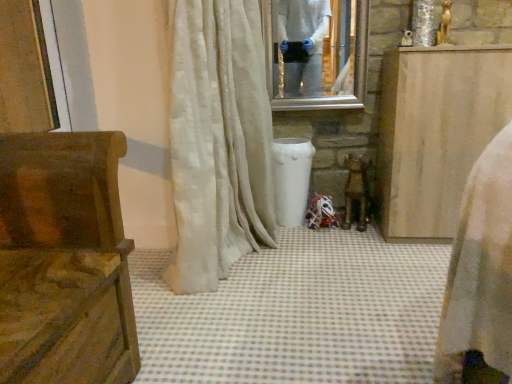
You are a GUI agent. You are given a task and a screenshot of the screen. Output one action in this format:
    pyautogui.click(x=<x>, y=<y>)
    Task: Click on the wooden at center
    
    Given the screenshot: What is the action you would take?
    pyautogui.click(x=356, y=192)

Describe the element at coordinates (218, 140) in the screenshot. The height and width of the screenshot is (384, 512). I see `white silky curtain at center` at that location.

Measure the distance between point [300,83] and camera.

Point [300,83] and camera are 2.16 meters apart from each other.

Where is `clear glass mirror at upper center`? The image size is (512, 384). clear glass mirror at upper center is located at coordinates click(x=313, y=47).

At what (x,y) coordinates should I click in order to perform the action: click on wooden carved bench at left, arranged as the 1th furniture when viewed from the left. Please return your answer as a coordinate pair (x, y). The width and height of the screenshot is (512, 384). Looking at the image, I should click on (67, 229).

Measure the distance from light brown wood cabinet at right, which is counted as the second furniture, starting from the front, to wooden carved bench at left, positioned as the second furniture in right-to-left order.

light brown wood cabinet at right, which is counted as the second furniture, starting from the front, and wooden carved bench at left, positioned as the second furniture in right-to-left order, are 4.47 feet apart from each other.

Considering the positions of objects light brown wood cabinet at right, the first furniture viewed from the back, and wooden carved bench at left, positioned as the second furniture in right-to-left order, in the image provided, who is in front, light brown wood cabinet at right, the first furniture viewed from the back, or wooden carved bench at left, positioned as the second furniture in right-to-left order,?

wooden carved bench at left, positioned as the second furniture in right-to-left order, is in front.

Is light brown wood cabinet at right, arranged as the first furniture when viewed from the right, placed right next to wooden carved bench at left, which ranks as the second furniture in back-to-front order?

They are not placed beside each other.

Consider the image. Is light brown wood cabinet at right, the first furniture viewed from the back, shorter than wooden carved bench at left, positioned as the second furniture in right-to-left order?

In fact, light brown wood cabinet at right, the first furniture viewed from the back, may be taller than wooden carved bench at left, positioned as the second furniture in right-to-left order.

Can you confirm if clear glass mirror at upper center is wider than wooden at center?

No.

From the image's perspective, between clear glass mirror at upper center and wooden at center, who is located below?

wooden at center appears lower in the image.

Could you tell me if clear glass mirror at upper center is turned towards wooden at center?

No.

Can you tell me how much clear glass mirror at upper center and wooden at center differ in facing direction?

10.9 degrees separate the facing orientations of clear glass mirror at upper center and wooden at center.

Does point (410, 61) come farther from viewer compared to point (325, 58)?

No, (410, 61) is in front of (325, 58).

Which object is further away from the camera, light brown wood cabinet at right, arranged as the first furniture when viewed from the right, or clear glass mirror at upper center?

clear glass mirror at upper center is further away from the camera.

From the image's perspective, between light brown wood cabinet at right, which is counted as the second furniture, starting from the front, and clear glass mirror at upper center, which one is located above?

clear glass mirror at upper center is shown above in the image.

Visually, is light brown wood cabinet at right, the first furniture viewed from the back, positioned to the left or to the right of clear glass mirror at upper center?

Clearly, light brown wood cabinet at right, the first furniture viewed from the back, is on the right of clear glass mirror at upper center in the image.

From a real-world perspective, which is physically above, white silky curtain at center or wooden at center?

From a 3D spatial view, white silky curtain at center is above.

Is white silky curtain at center touching wooden at center?

No, white silky curtain at center is not beside wooden at center.

Which is further, (199, 248) or (368, 211)?

The point (368, 211) is more distant.

Considering the relative sizes of wooden at center and light brown wood cabinet at right, the first furniture viewed from the back, in the image provided, is wooden at center wider than light brown wood cabinet at right, the first furniture viewed from the back,?

Incorrect, the width of wooden at center does not surpass that of light brown wood cabinet at right, the first furniture viewed from the back.

Is wooden at center to the right of light brown wood cabinet at right, arranged as the first furniture when viewed from the right, from the viewer's perspective?

In fact, wooden at center is to the left of light brown wood cabinet at right, arranged as the first furniture when viewed from the right.

Can you see wooden at center touching light brown wood cabinet at right, which is counted as the second furniture, starting from the front?

No, wooden at center is not touching light brown wood cabinet at right, which is counted as the second furniture, starting from the front.

Find the location of a particular element. Image resolution: width=512 pixels, height=384 pixels. curtain that is above the wooden carved bench at left, positioned as the second furniture in right-to-left order (from the image's perspective) is located at coordinates (218, 140).

Is wooden carved bench at left, arranged as the 1th furniture when viewed from the left, further to camera compared to white silky curtain at center?

No.

Is white silky curtain at center inside wooden carved bench at left, arranged as the 1th furniture when viewed from the left?

No, white silky curtain at center is not surrounded by wooden carved bench at left, arranged as the 1th furniture when viewed from the left.

From a real-world perspective, which is physically above, wooden carved bench at left, the first furniture when ordered from front to back, or white silky curtain at center?

white silky curtain at center.

From a real-world perspective, does white silky curtain at center sit lower than light brown wood cabinet at right, the first furniture viewed from the back?

No, from a real-world perspective, white silky curtain at center is not beneath light brown wood cabinet at right, the first furniture viewed from the back.

Which object is closer to the camera taking this photo, white silky curtain at center or light brown wood cabinet at right, which is counted as the second furniture, starting from the front?

white silky curtain at center is in front.

Looking at the image, does white silky curtain at center seem bigger or smaller compared to light brown wood cabinet at right, arranged as the first furniture when viewed from the right?

Clearly, white silky curtain at center is larger in size than light brown wood cabinet at right, arranged as the first furniture when viewed from the right.

Is point (203, 149) closer to camera compared to point (503, 102)?

That is True.

In order to click on furniture that appears behind the wooden carved bench at left, arranged as the 1th furniture when viewed from the left in this screenshot , I will do `click(436, 131)`.

You are a GUI agent. You are given a task and a screenshot of the screen. Output one action in this format:
    pyautogui.click(x=<x>, y=<y>)
    Task: Click on the chair that is under the clear glass mirror at upper center (from a real-world perspective)
    The image size is (512, 384).
    Given the screenshot: What is the action you would take?
    pyautogui.click(x=356, y=192)

Based on their spatial positions, is wooden carved bench at left, positioned as the second furniture in right-to-left order, or white silky curtain at center closer to clear glass mirror at upper center?

white silky curtain at center is positioned closer to the anchor clear glass mirror at upper center.

Looking at the image, which one is located closer to wooden at center, white silky curtain at center or wooden carved bench at left, arranged as the 1th furniture when viewed from the left?

white silky curtain at center is positioned closer to the anchor wooden at center.

Considering their positions, is wooden carved bench at left, the first furniture when ordered from front to back, positioned further to clear glass mirror at upper center than light brown wood cabinet at right, the first furniture viewed from the back?

wooden carved bench at left, the first furniture when ordered from front to back.

Looking at the image, which one is located further to light brown wood cabinet at right, the first furniture viewed from the back, wooden carved bench at left, the first furniture when ordered from front to back, or white silky curtain at center?

Based on the image, wooden carved bench at left, the first furniture when ordered from front to back, appears to be further to light brown wood cabinet at right, the first furniture viewed from the back.

Considering their positions, is light brown wood cabinet at right, which is counted as the second furniture, starting from the front, positioned further to white silky curtain at center than clear glass mirror at upper center?

light brown wood cabinet at right, which is counted as the second furniture, starting from the front, is further to white silky curtain at center.

Considering their positions, is wooden at center positioned further to clear glass mirror at upper center than light brown wood cabinet at right, arranged as the first furniture when viewed from the right?

Based on the image, wooden at center appears to be further to clear glass mirror at upper center.

When comparing their distances from white silky curtain at center, does clear glass mirror at upper center or wooden at center seem closer?

Among the two, clear glass mirror at upper center is located nearer to white silky curtain at center.

Looking at the image, which one is located closer to white silky curtain at center, clear glass mirror at upper center or light brown wood cabinet at right, which is counted as the second furniture, starting from the front?

The object closer to white silky curtain at center is clear glass mirror at upper center.

Where is `chair between wooden carved bench at left, the first furniture when ordered from front to back, and clear glass mirror at upper center in the front-back direction`? The width and height of the screenshot is (512, 384). chair between wooden carved bench at left, the first furniture when ordered from front to back, and clear glass mirror at upper center in the front-back direction is located at coordinates (356, 192).

You are a GUI agent. You are given a task and a screenshot of the screen. Output one action in this format:
    pyautogui.click(x=<x>, y=<y>)
    Task: Click on the curtain between wooden carved bench at left, which ranks as the second furniture in back-to-front order, and wooden at center in the front-back direction
    
    Given the screenshot: What is the action you would take?
    (x=218, y=140)

Identify the location of mirror between wooden carved bench at left, arranged as the 1th furniture when viewed from the left, and light brown wood cabinet at right, arranged as the first furniture when viewed from the right. click(313, 47).

What are the coordinates of `curtain situated between wooden carved bench at left, the first furniture when ordered from front to back, and light brown wood cabinet at right, the first furniture viewed from the back, from left to right` in the screenshot? It's located at (218, 140).